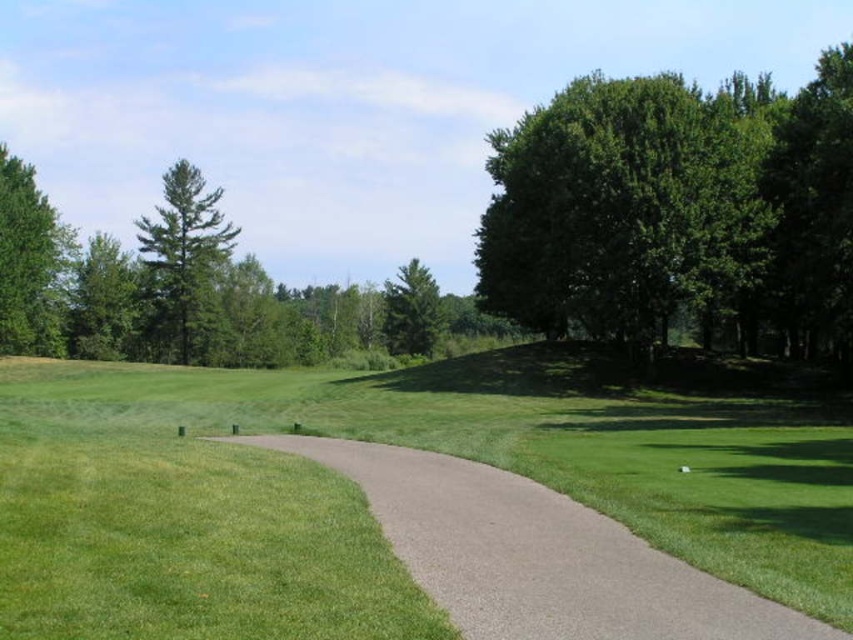
Question: Which point is closer to the camera taking this photo?

Choices:
 (A) (161, 244)
 (B) (100, 252)

Answer: (A)

Question: Can you confirm if gray asphalt path at center is bigger than green leafy tree at left?

Choices:
 (A) no
 (B) yes

Answer: (A)

Question: From the image, what is the correct spatial relationship of gray asphalt path at center in relation to green matte tree at center?

Choices:
 (A) below
 (B) above

Answer: (A)

Question: Does gray asphalt path at center have a smaller size compared to green textured tree at upper left?

Choices:
 (A) no
 (B) yes

Answer: (B)

Question: Estimate the real-world distances between objects in this image. Which object is closer to the green leafy tree at upper right?

Choices:
 (A) gray asphalt path at center
 (B) green matte tree at center
 (C) green leafy tree at left
 (D) green leafy tree at upper left

Answer: (A)

Question: Which object is positioned farthest from the green textured tree at upper left?

Choices:
 (A) green leafy tree at left
 (B) green matte tree at center
 (C) gray asphalt path at center

Answer: (C)